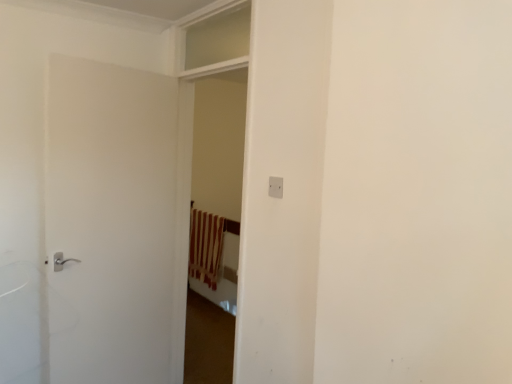
The image size is (512, 384). Describe the element at coordinates (205, 247) in the screenshot. I see `brown striped curtain at center` at that location.

Locate an element on the screen. The width and height of the screenshot is (512, 384). white matte door at left is located at coordinates (110, 221).

How much distance is there between white plastic electric outlet at center and brown striped curtain at center?

white plastic electric outlet at center and brown striped curtain at center are 8.37 feet apart.

Does white plastic electric outlet at center touch brown striped curtain at center?

No, white plastic electric outlet at center is not beside brown striped curtain at center.

Is white plastic electric outlet at center at the right side of brown striped curtain at center?

Yes.

From a real-world perspective, is white plastic electric outlet at center over brown striped curtain at center?

Yes, from a real-world perspective, white plastic electric outlet at center is over brown striped curtain at center

Looking at this image, measure the distance between white matte door at left and brown striped curtain at center.

white matte door at left is 1.78 meters away from brown striped curtain at center.

There is a brown striped curtain at center. Identify the location of door above it (from a real-world perspective). The width and height of the screenshot is (512, 384). (110, 221).

Which of these two, white matte door at left or brown striped curtain at center, stands taller?

white matte door at left is taller.

Considering the positions of objects white matte door at left and brown striped curtain at center in the image provided, who is more to the right, white matte door at left or brown striped curtain at center?

brown striped curtain at center is more to the right.

From the picture: Would you say brown striped curtain at center is outside white plastic electric outlet at center?

Indeed, brown striped curtain at center is completely outside white plastic electric outlet at center.

Relative to white plastic electric outlet at center, is brown striped curtain at center in front or behind?

Visually, brown striped curtain at center is located behind white plastic electric outlet at center.

Between brown striped curtain at center and white plastic electric outlet at center, which one has smaller width?

white plastic electric outlet at center is thinner.

Which is more to the right, brown striped curtain at center or white plastic electric outlet at center?

white plastic electric outlet at center.

From a real-world perspective, which object rests below the other?

white plastic electric outlet at center.

Which object is positioned more to the right, clear glass window at upper center or white plastic electric outlet at center?

white plastic electric outlet at center is more to the right.

Is clear glass window at upper center outside of white plastic electric outlet at center?

Yes, clear glass window at upper center is located beyond the bounds of white plastic electric outlet at center.

Would you say clear glass window at upper center contains brown striped curtain at center?

No, brown striped curtain at center is not a part of clear glass window at upper center.

Which object is positioned more to the left, clear glass window at upper center or brown striped curtain at center?

Positioned to the left is brown striped curtain at center.

From the image's perspective, which one is positioned lower, clear glass window at upper center or brown striped curtain at center?

brown striped curtain at center is shown below in the image.

From a real-world perspective, which object rests below the other?

white plastic electric outlet at center, from a real-world perspective.

Would you say white plastic electric outlet at center is inside or outside clear glass window at upper center?

white plastic electric outlet at center is not enclosed by clear glass window at upper center.

Considering the sizes of objects white plastic electric outlet at center and clear glass window at upper center in the image provided, who is shorter, white plastic electric outlet at center or clear glass window at upper center?

Standing shorter between the two is white plastic electric outlet at center.

Is white plastic electric outlet at center directly adjacent to clear glass window at upper center?

No, white plastic electric outlet at center is not next to clear glass window at upper center.

Can you confirm if brown striped curtain at center is wider than white matte door at left?

Yes, brown striped curtain at center is wider than white matte door at left.

Which object is positioned more to the right, brown striped curtain at center or white matte door at left?

brown striped curtain at center.

Looking at this image, is brown striped curtain at center positioned with its back to white matte door at left?

No, brown striped curtain at center is not facing the opposite direction of white matte door at left.

Who is shorter, brown striped curtain at center or white matte door at left?

Standing shorter between the two is brown striped curtain at center.

Locate an element on the screen. This screenshot has width=512, height=384. curtain on the left of white plastic electric outlet at center is located at coordinates (205, 247).

The width and height of the screenshot is (512, 384). Identify the location of curtain on the right of white matte door at left. (205, 247).

Based on their spatial positions, is brown striped curtain at center or white matte door at left closer to clear glass window at upper center?

white matte door at left.

Considering their positions, is white plastic electric outlet at center positioned further to clear glass window at upper center than white matte door at left?

white plastic electric outlet at center is positioned further to the anchor clear glass window at upper center.

Based on their spatial positions, is white plastic electric outlet at center or clear glass window at upper center closer to white matte door at left?

clear glass window at upper center is closer to white matte door at left.

Based on their spatial positions, is clear glass window at upper center or white matte door at left further from white plastic electric outlet at center?

Among the two, white matte door at left is located further to white plastic electric outlet at center.

Considering their positions, is brown striped curtain at center positioned closer to white plastic electric outlet at center than white matte door at left?

white matte door at left lies closer to white plastic electric outlet at center than the other object.

From the image, which object appears to be farther from clear glass window at upper center, white matte door at left or brown striped curtain at center?

brown striped curtain at center is further to clear glass window at upper center.

Considering their positions, is white plastic electric outlet at center positioned closer to brown striped curtain at center than white matte door at left?

Based on the image, white matte door at left appears to be nearer to brown striped curtain at center.

From the image, which object appears to be nearer to brown striped curtain at center, white matte door at left or white plastic electric outlet at center?

Based on the image, white matte door at left appears to be nearer to brown striped curtain at center.

Locate an element on the screen. This screenshot has width=512, height=384. window positioned between white matte door at left and brown striped curtain at center from near to far is located at coordinates (218, 42).

Find the location of a particular element. The width and height of the screenshot is (512, 384). electric outlet that lies between clear glass window at upper center and white matte door at left from top to bottom is located at coordinates (276, 187).

Where is `door located between white plastic electric outlet at center and brown striped curtain at center in the depth direction`? door located between white plastic electric outlet at center and brown striped curtain at center in the depth direction is located at coordinates (110, 221).

Image resolution: width=512 pixels, height=384 pixels. Identify the location of window between white plastic electric outlet at center and brown striped curtain at center from front to back. (218, 42).